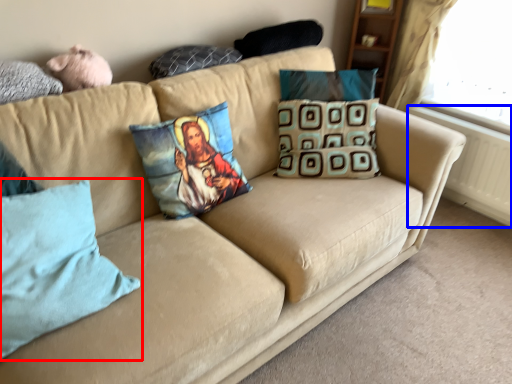
Question: Among these objects, which one is nearest to the camera, pillow (highlighted by a red box) or radiator (highlighted by a blue box)?

Choices:
 (A) pillow
 (B) radiator

Answer: (A)